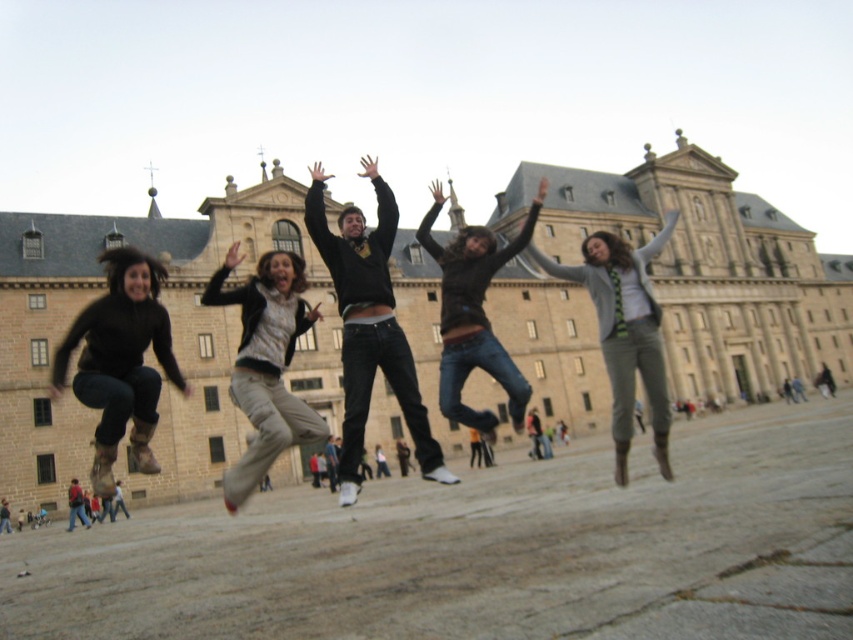
Can you confirm if dark gray hoodie at center is taller than light gray knit sweater at center?

Correct, dark gray hoodie at center is much taller as light gray knit sweater at center.

I want to click on dark gray hoodie at center, so click(368, 324).

Locate an element on the screen. Image resolution: width=853 pixels, height=640 pixels. dark gray hoodie at center is located at coordinates (368, 324).

Between matte black sweater at left and red jacket at lower left, which one has less height?

red jacket at lower left is shorter.

Can you confirm if matte black sweater at left is taller than red jacket at lower left?

Yes, matte black sweater at left is taller than red jacket at lower left.

Between point (157, 346) and point (73, 477), which one is positioned behind?

Point (73, 477)

Locate an element on the screen. Image resolution: width=853 pixels, height=640 pixels. matte black sweater at left is located at coordinates (120, 362).

Is matte black sweater at left below khaki pants at center?

No.

Between point (148, 308) and point (291, 353), which one is positioned behind?

Point (291, 353)

The height and width of the screenshot is (640, 853). Identify the location of matte black sweater at left. (120, 362).